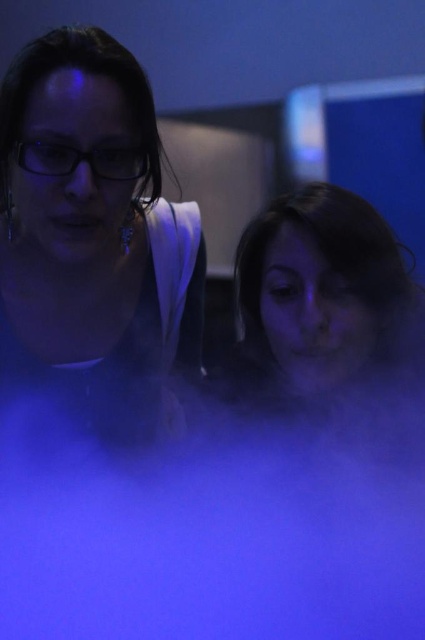
Based on the photo, does matte black hair at left have a greater height compared to matte skin at center?

Correct, matte black hair at left is much taller as matte skin at center.

Is point (79, 378) farther from viewer compared to point (340, 280)?

Yes, point (79, 378) is farther from viewer.

This screenshot has height=640, width=425. Identify the location of matte black hair at left. (93, 237).